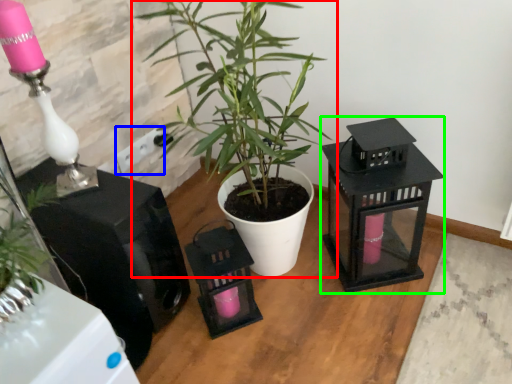
Question: Which object is the farthest from houseplant (highlighted by a red box)? Choose among these: electric outlet (highlighted by a blue box) or appliance (highlighted by a green box).

Choices:
 (A) electric outlet
 (B) appliance

Answer: (A)